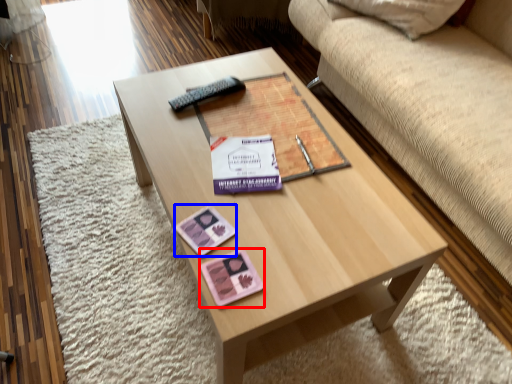
Question: Which point is closer to the camera, currency (highlighted by a red box) or currency (highlighted by a blue box)?

Choices:
 (A) currency
 (B) currency

Answer: (A)